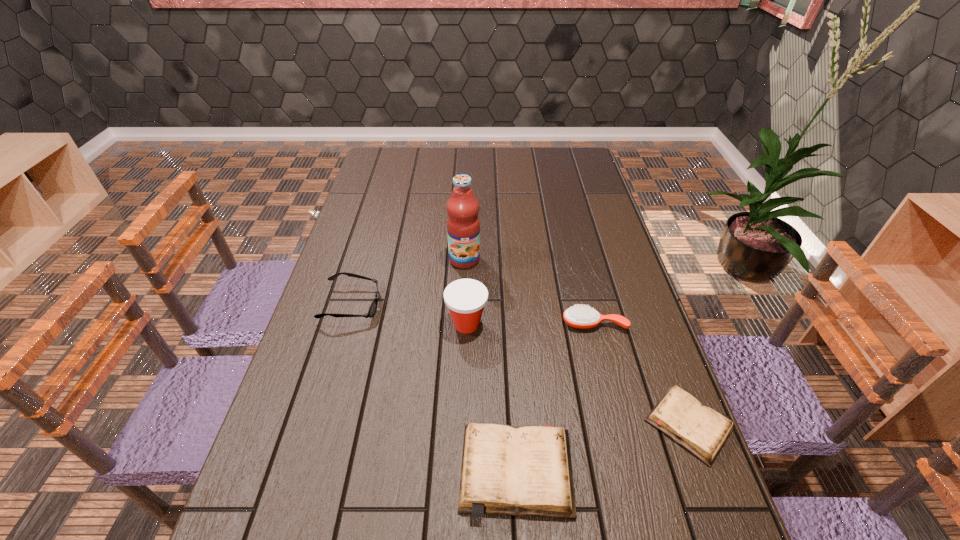
Where is `free area in between the right diary and the Dixie cup`? This screenshot has height=540, width=960. free area in between the right diary and the Dixie cup is located at coordinates (578, 374).

This screenshot has width=960, height=540. What are the coordinates of `free area in between the shortest object and the second tallest object` in the screenshot? It's located at (578, 374).

Find the location of a particular element. free space between the hairbrush and the shorter diary is located at coordinates (641, 374).

Identify the location of empty space between the sunglasses and the shortest object. Image resolution: width=960 pixels, height=540 pixels. (520, 365).

Locate an element on the screen. free area in between the shortest object and the Dixie cup is located at coordinates (578, 374).

At what (x,y) coordinates should I click in order to perform the action: click on unoccupied area between the left diary and the fruit juice. Please return your answer as a coordinate pair (x, y). Looking at the image, I should click on (491, 365).

Identify which object is located as the fourth nearest to the fifth shortest object. Please provide its 2D coordinates. Your answer should be formatted as a tuple, i.e. [(x, y)], where the tuple contains the x and y coordinates of a point satisfying the conditions above.

[(520, 471)]

Identify which object is the fourth closest to the hairbrush. Please provide its 2D coordinates. Your answer should be formatted as a tuple, i.e. [(x, y)], where the tuple contains the x and y coordinates of a point satisfying the conditions above.

[(463, 225)]

The height and width of the screenshot is (540, 960). I want to click on free space that satisfies the following two spatial constraints: 1. on the lenses of the hairbrush; 2. on the right side of the sunglasses, so click(347, 323).

Locate an element on the screen. The height and width of the screenshot is (540, 960). vacant space that satisfies the following two spatial constraints: 1. on the front label of the tallest object; 2. on the lenses of the sunglasses is located at coordinates (463, 305).